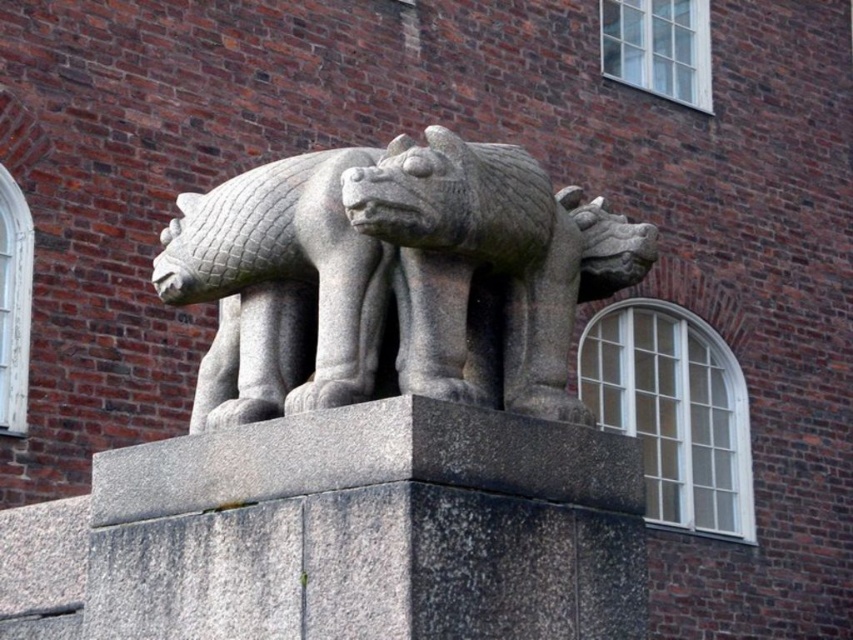
You are an art curator planning to display both the gray stone statue at center and the gray stone lion at center in a gallery. Given their sizes, which one should be placed closer to the entrance to ensure visitors can easily see both without overcrowding the space?

The gray stone statue at center is bigger than the gray stone lion at center. To ensure visitors can easily see both without overcrowding the space, the larger gray stone statue at center should be placed closer to the entrance, allowing more space around it, while the smaller gray stone lion at center can be positioned further back or in a less prominent area.

You are standing in front of a stone sculpture of a mythical creature on a pedestal. There is a point marked at coordinates (393, 278). What does this point represent?

The point at coordinates (393, 278) marks the gray stone statue at center.